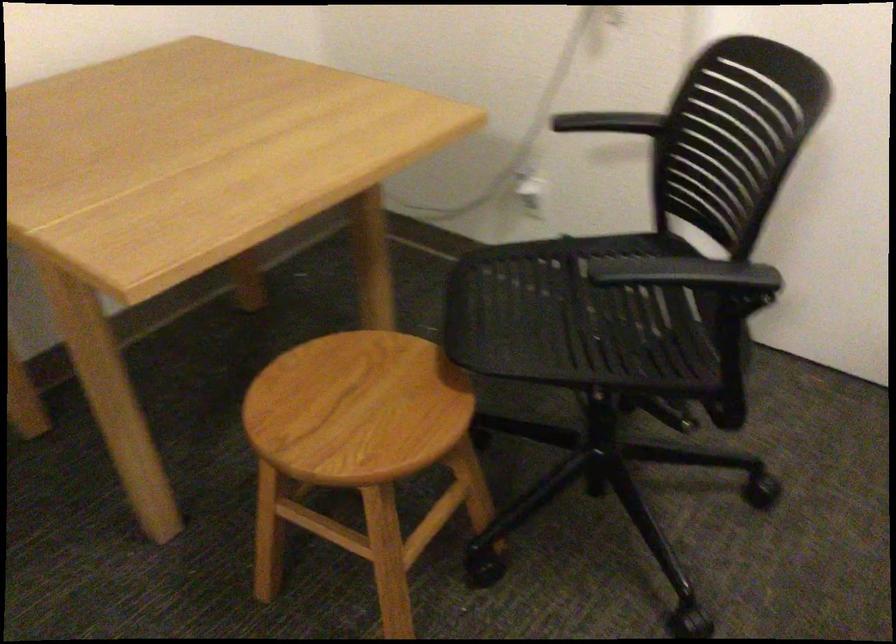
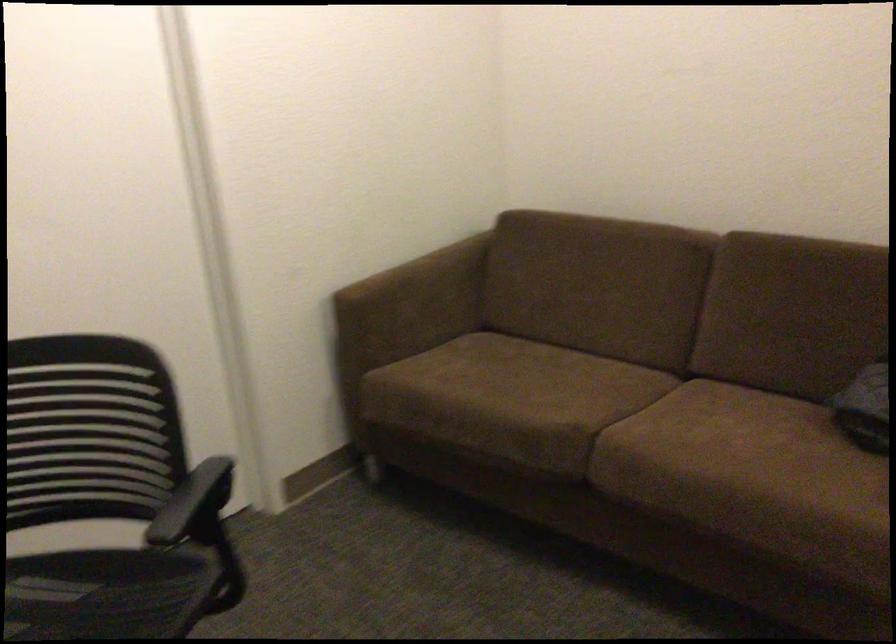
Locate, in the second image, the point that corresponds to the point at 701,279 in the first image.

(192, 500)